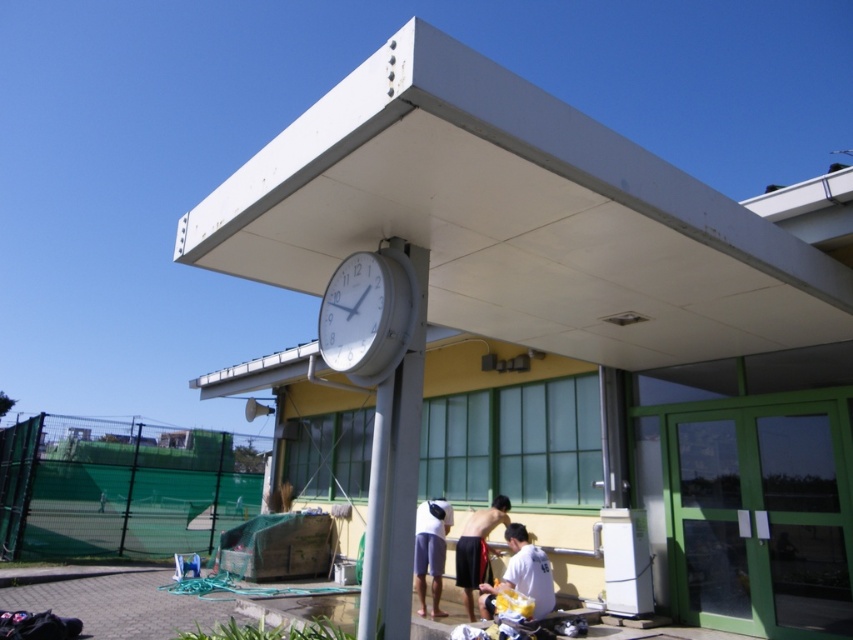
Is white plastic clock at center to the right of shiny black shorts at lower center from the viewer's perspective?

In fact, white plastic clock at center is to the left of shiny black shorts at lower center.

Who is positioned more to the left, white plastic clock at center or shiny black shorts at lower center?

From the viewer's perspective, white plastic clock at center appears more on the left side.

Locate an element on the screen. This screenshot has height=640, width=853. white plastic clock at center is located at coordinates (363, 314).

Between white plastic clock at center and white matte shorts at lower center, which one is positioned lower?

white matte shorts at lower center

Does white plastic clock at center have a larger size compared to white matte shorts at lower center?

Incorrect, white plastic clock at center is not larger than white matte shorts at lower center.

Identify the location of white plastic clock at center. The height and width of the screenshot is (640, 853). (363, 314).

Image resolution: width=853 pixels, height=640 pixels. Identify the location of white plastic clock at center. (363, 314).

Is shiny black shorts at lower center positioned behind white matte shorts at lower center?

No.

Who is more distant from viewer, (473, 600) or (419, 593)?

The point (473, 600) is behind.

Image resolution: width=853 pixels, height=640 pixels. Find the location of `shiny black shorts at lower center`. shiny black shorts at lower center is located at coordinates tap(477, 548).